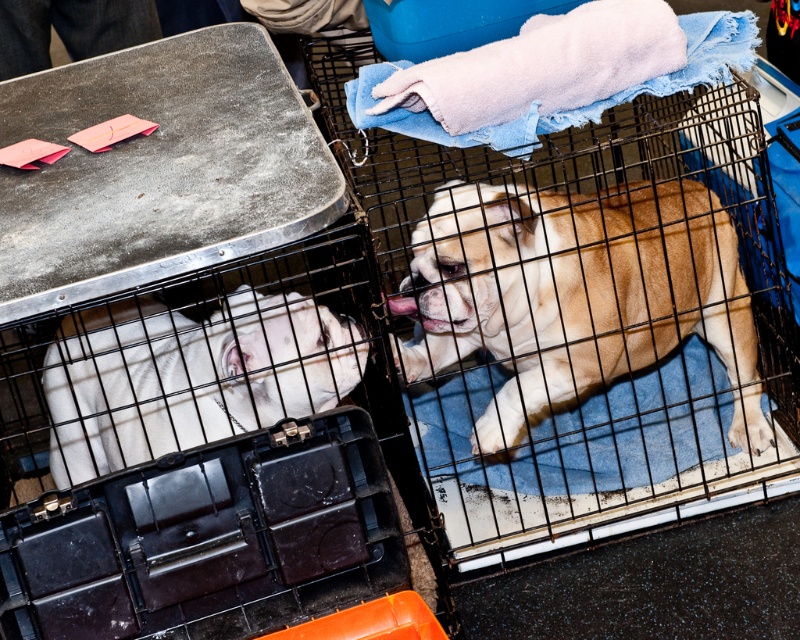
You are a judge at a dog show and need to determine which dog has a larger size based on their fur color. The dogs are the light brown fur at center and the white smooth dog at left. Which one is bigger?

The light brown fur at center is larger in size than the white smooth dog at left, so the light brown fur at center is bigger.